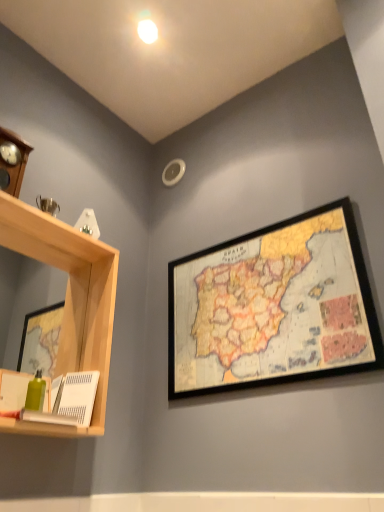
Question: Is wooden framed map at upper right to the left of light wood shelf at left from the viewer's perspective?

Choices:
 (A) no
 (B) yes

Answer: (A)

Question: From a real-world perspective, is wooden framed map at upper right below light wood shelf at left?

Choices:
 (A) no
 (B) yes

Answer: (A)

Question: Is wooden framed map at upper right bigger than light wood shelf at left?

Choices:
 (A) yes
 (B) no

Answer: (B)

Question: From the image's perspective, does wooden framed map at upper right appear higher than light wood shelf at left?

Choices:
 (A) no
 (B) yes

Answer: (B)

Question: Is light wood shelf at left surrounded by wooden framed map at upper right?

Choices:
 (A) no
 (B) yes

Answer: (A)

Question: Considering the relative sizes of wooden framed map at upper right and light wood shelf at left in the image provided, is wooden framed map at upper right shorter than light wood shelf at left?

Choices:
 (A) yes
 (B) no

Answer: (A)

Question: From the image's perspective, is light wood shelf at left located above wooden framed map at upper right?

Choices:
 (A) no
 (B) yes

Answer: (A)

Question: Is wooden framed map at upper right a part of light wood shelf at left?

Choices:
 (A) yes
 (B) no

Answer: (B)

Question: Does light wood shelf at left lie behind wooden framed map at upper right?

Choices:
 (A) no
 (B) yes

Answer: (A)

Question: Can you confirm if light wood shelf at left is wider than wooden framed map at upper right?

Choices:
 (A) yes
 (B) no

Answer: (A)

Question: Is light wood shelf at left touching wooden framed map at upper right?

Choices:
 (A) yes
 (B) no

Answer: (B)

Question: Considering the relative positions of light wood shelf at left and wooden framed map at upper right in the image provided, is light wood shelf at left to the right of wooden framed map at upper right from the viewer's perspective?

Choices:
 (A) no
 (B) yes

Answer: (A)

Question: From a real-world perspective, is light wood shelf at left above or below wooden framed map at upper right?

Choices:
 (A) above
 (B) below

Answer: (B)